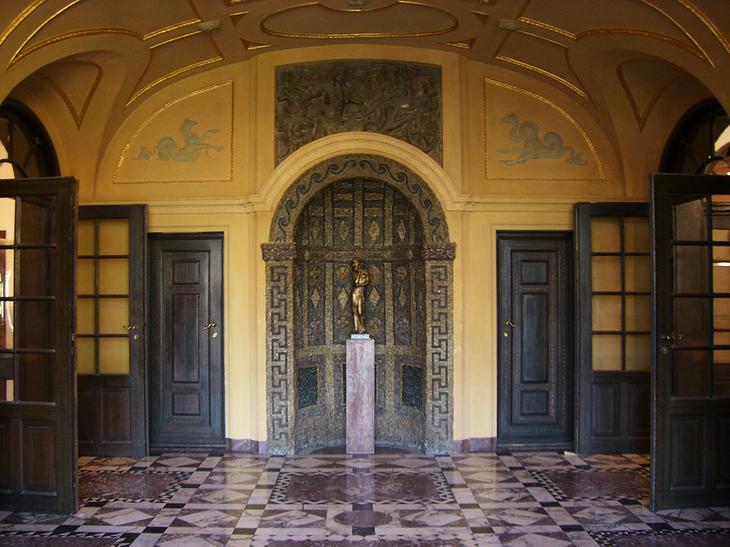
Find the location of `ceiling`. ceiling is located at coordinates (123, 8).